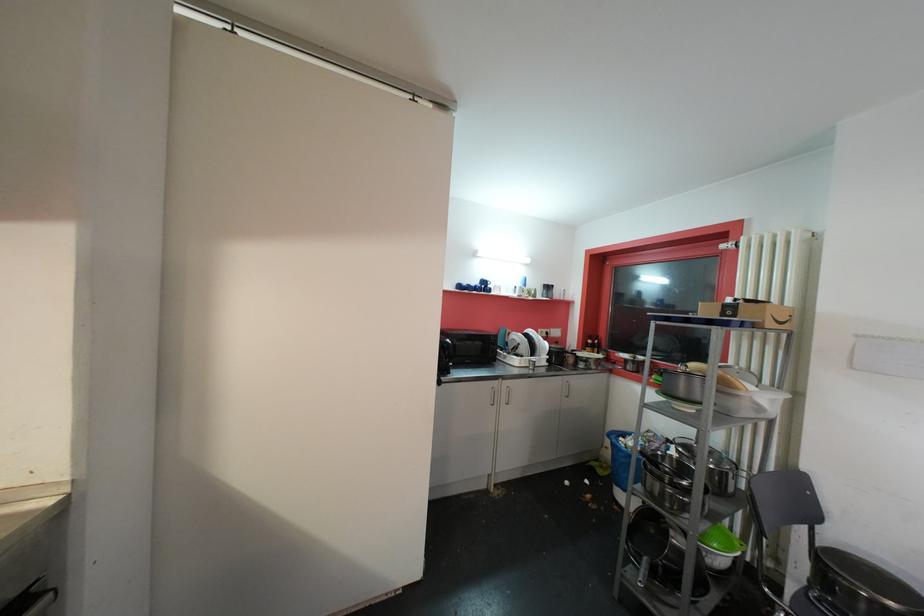
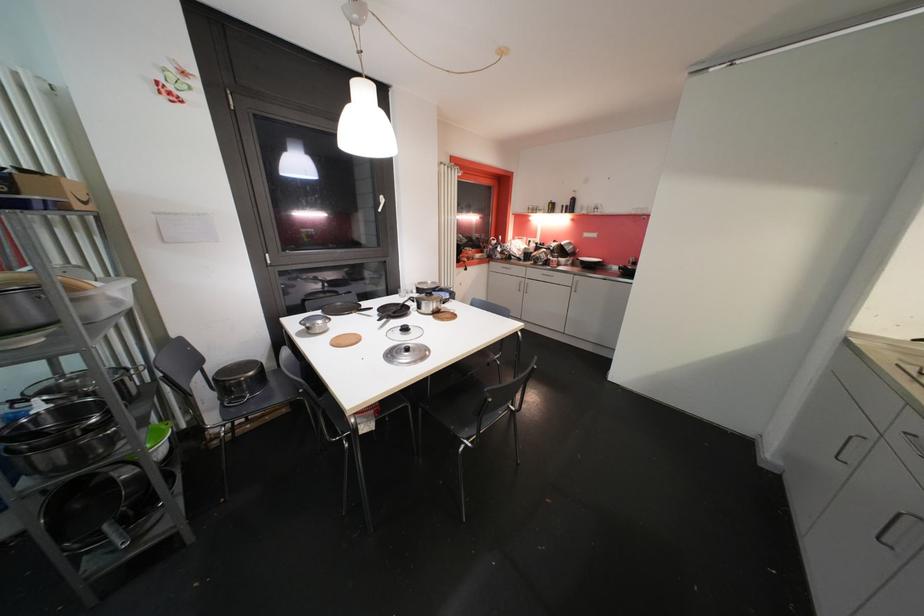
The first image is from the beginning of the video and the second image is from the end. How did the camera likely rotate when shooting the video?

The rotation direction of the camera is right-down.